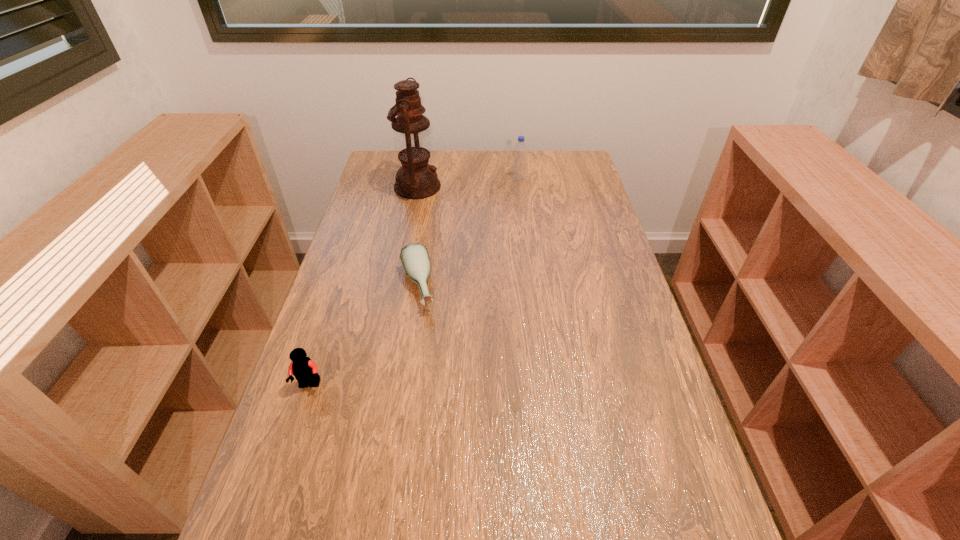
Image resolution: width=960 pixels, height=540 pixels. Find the location of `the tallest object`. the tallest object is located at coordinates (416, 179).

Image resolution: width=960 pixels, height=540 pixels. I want to click on the right bottle, so click(520, 150).

At what (x,y) coordinates should I click in order to perform the action: click on the rightmost object. Please return your answer as a coordinate pair (x, y). Looking at the image, I should click on (520, 150).

Locate an element on the screen. The image size is (960, 540). the leftmost object is located at coordinates (305, 371).

I want to click on the nearest object, so [x=305, y=371].

You are a GUI agent. You are given a task and a screenshot of the screen. Output one action in this format:
    pyautogui.click(x=<x>, y=<y>)
    Task: Click on the nearer bottle
    
    Given the screenshot: What is the action you would take?
    pyautogui.click(x=414, y=257)

Locate an element on the screen. This screenshot has height=540, width=960. the shorter bottle is located at coordinates (414, 257).

This screenshot has width=960, height=540. Find the location of `free region located on the front of the tallest object`. free region located on the front of the tallest object is located at coordinates (405, 252).

Locate an element on the screen. The image size is (960, 540). vacant space located 0.070m on the front of the rightmost object is located at coordinates (x=520, y=193).

Find the location of a particular element. Image resolution: width=960 pixels, height=540 pixels. vacant region located 0.050m on the front-facing side of the Lego is located at coordinates (300, 414).